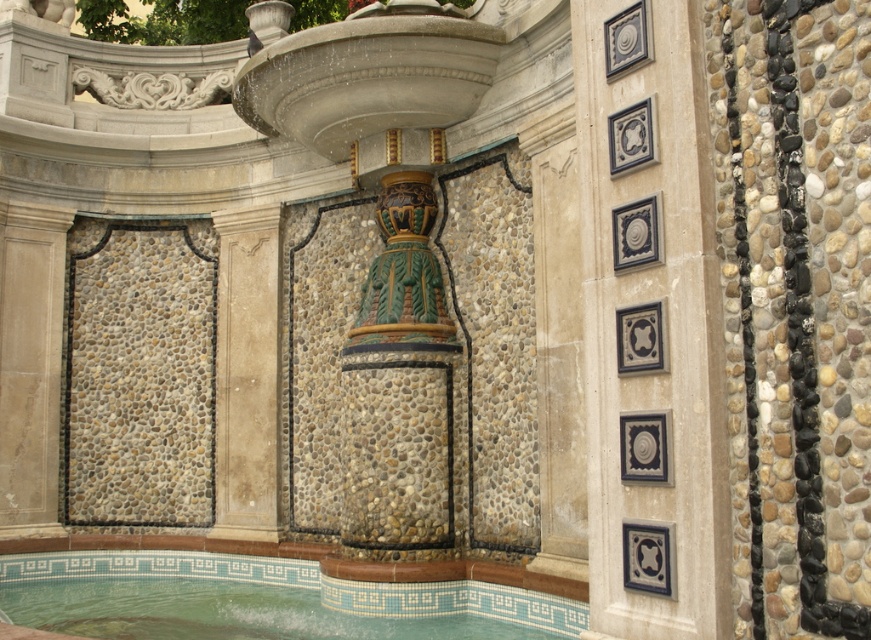
Can you confirm if dark gray stone tiles at center is positioned to the left of green mosaic tile pool at center?

No, dark gray stone tiles at center is not to the left of green mosaic tile pool at center.

Is dark gray stone tiles at center shorter than green mosaic tile pool at center?

Incorrect, dark gray stone tiles at center's height does not fall short of green mosaic tile pool at center's.

Is point (650, 220) more distant than point (547, 621)?

That is False.

The height and width of the screenshot is (640, 871). Identify the location of dark gray stone tiles at center. (650, 326).